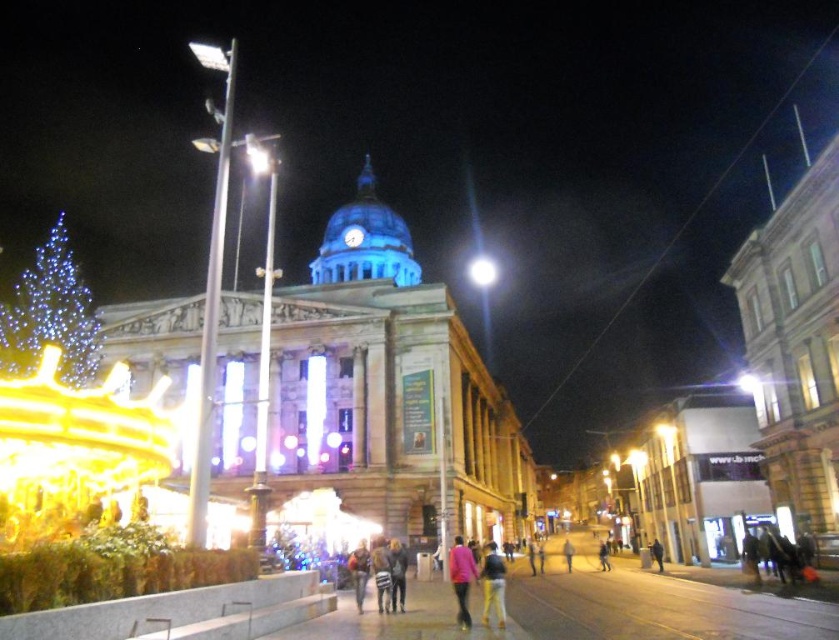
Does pink matte jacket at center have a lesser width compared to light brown pants at center?

Yes.

Image resolution: width=839 pixels, height=640 pixels. What do you see at coordinates (461, 577) in the screenshot? I see `pink matte jacket at center` at bounding box center [461, 577].

Find the location of a particular element. Image resolution: width=839 pixels, height=640 pixels. pink matte jacket at center is located at coordinates (461, 577).

Which of these two, pink matte jacket at center or bright white light at center, stands taller?

bright white light at center

Can you confirm if pink matte jacket at center is positioned to the right of bright white light at center?

Incorrect, pink matte jacket at center is not on the right side of bright white light at center.

Find the location of a particular element. Image resolution: width=839 pixels, height=640 pixels. pink matte jacket at center is located at coordinates (461, 577).

Consider the image. Is the position of pink matte jacket at center more distant than that of denim pants at center?

That is False.

Can you confirm if pink matte jacket at center is shorter than denim pants at center?

In fact, pink matte jacket at center may be taller than denim pants at center.

Which is in front, point (461, 566) or point (358, 556)?

Point (461, 566) is more forward.

What are the coordinates of `pink matte jacket at center` in the screenshot? It's located at (461, 577).